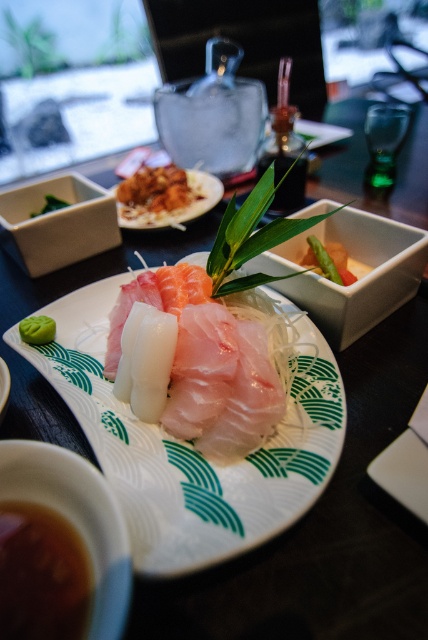
You are a customer at a Japanese restaurant and want to move the brown rice at upper left closer to the white ceramic bowl at center. Which direction should you move it towards?

The white ceramic bowl at center is closer to you than the brown rice at upper left, so you should move the brown rice at upper left towards the direction of the white ceramic bowl at center to bring it closer.

You are a food critic evaluating the presentation of this sashimi dish. You notice the brown rice at upper left and the green matte wasabi at center. Which component is taller in this dish?

The brown rice at upper left is taller than the green matte wasabi at center.

You are a food critic who wants to describe the arrangement of the dish. Where is the white ceramic bowl at center in relation to the brown rice at upper left?

The white ceramic bowl at center is to the right of brown rice at upper left.